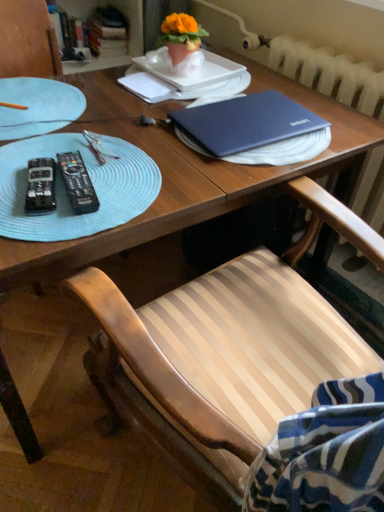
The width and height of the screenshot is (384, 512). What do you see at coordinates (66, 34) in the screenshot?
I see `hardcover book at upper left, placed as the 1th book when sorted from left to right` at bounding box center [66, 34].

This screenshot has width=384, height=512. What are the coordinates of `orange matte flower pot at upper center` in the screenshot? It's located at (181, 36).

What is the approximate height of matte blue laptop at center?

matte blue laptop at center is 1.98 inches in height.

Describe the element at coordinates (246, 122) in the screenshot. I see `matte blue laptop at center` at that location.

The image size is (384, 512). What are the coordinates of `light blue textured glass plate at left, the 1th glass plate in the top-to-bottom sequence` in the screenshot? It's located at (38, 106).

The image size is (384, 512). In order to click on blue woven placemat at left, which is the first glass plate from bottom to top in this screenshot , I will do `click(66, 192)`.

Where is `hardcover book at upper left, placed as the 1th book when sorted from left to right`? This screenshot has height=512, width=384. hardcover book at upper left, placed as the 1th book when sorted from left to right is located at coordinates (66, 34).

Between blue woven placemat at left, the second glass plate viewed from the top, and white textured radiator at upper right, which one has larger size?

Bigger between the two is white textured radiator at upper right.

From the white textured radiator at upper right, count 2nd glass plates forward and point to it. Please provide its 2D coordinates.

[(66, 192)]

From a real-world perspective, is blue woven placemat at left, the second glass plate viewed from the top, under white textured radiator at upper right?

No, from a real-world perspective, blue woven placemat at left, the second glass plate viewed from the top, is not below white textured radiator at upper right.

Is there a large distance between blue woven placemat at left, which is the first glass plate from bottom to top, and white textured radiator at upper right?

blue woven placemat at left, which is the first glass plate from bottom to top, is near white textured radiator at upper right, not far away.

Considering the positions of objects black plastic remote control at left, which is counted as the second remote control, starting from the left, and matte blue laptop at center in the image provided, who is in front, black plastic remote control at left, which is counted as the second remote control, starting from the left, or matte blue laptop at center?

black plastic remote control at left, which is counted as the second remote control, starting from the left.

Which of these two, black plastic remote control at left, the first remote control viewed from the right, or matte blue laptop at center, stands shorter?

With less height is black plastic remote control at left, the first remote control viewed from the right.

Is black plastic remote control at left, which is counted as the second remote control, starting from the left, inside or outside of matte blue laptop at center?

black plastic remote control at left, which is counted as the second remote control, starting from the left, cannot be found inside matte blue laptop at center.

Which object is positioned more to the left, black plastic remote control at left, the first remote control viewed from the right, or matte blue laptop at center?

From the viewer's perspective, black plastic remote control at left, the first remote control viewed from the right, appears more on the left side.

Between orange matte flower pot at upper center and blue woven placemat at left, the second glass plate viewed from the top, which one appears on the left side from the viewer's perspective?

blue woven placemat at left, the second glass plate viewed from the top, is more to the left.

From a real-world perspective, which object stands above the other?

orange matte flower pot at upper center, from a real-world perspective.

Does orange matte flower pot at upper center turn towards blue woven placemat at left, which is the first glass plate from bottom to top?

No, orange matte flower pot at upper center does not turn towards blue woven placemat at left, which is the first glass plate from bottom to top.

Can you tell me how much white paper at upper center and orange matte flower pot at upper center differ in facing direction?

The angle between the facing direction of white paper at upper center and the facing direction of orange matte flower pot at upper center is 0.718 degrees.

Considering the relative sizes of white paper at upper center and orange matte flower pot at upper center in the image provided, is white paper at upper center shorter than orange matte flower pot at upper center?

Indeed, white paper at upper center has a lesser height compared to orange matte flower pot at upper center.

Relative to orange matte flower pot at upper center, is white paper at upper center in front or behind?

Visually, white paper at upper center is located in front of orange matte flower pot at upper center.

Is black plastic remote control at left, which appears as the 1th remote control when viewed from the left, aimed at hardcover book at upper left, which appears as the 2th book when viewed from the right?

No.

Is black plastic remote control at left, the 2th remote control when ordered from right to left, surrounding hardcover book at upper left, which appears as the 2th book when viewed from the right?

No, black plastic remote control at left, the 2th remote control when ordered from right to left, does not contain hardcover book at upper left, which appears as the 2th book when viewed from the right.

Can you confirm if black plastic remote control at left, which appears as the 1th remote control when viewed from the left, is bigger than hardcover book at upper left, placed as the 1th book when sorted from left to right?

No, black plastic remote control at left, which appears as the 1th remote control when viewed from the left, is not bigger than hardcover book at upper left, placed as the 1th book when sorted from left to right.

The width and height of the screenshot is (384, 512). I want to click on the 1st book above the black plastic remote control at left, which appears as the 1th remote control when viewed from the left (from the image's perspective), so click(x=66, y=34).

What are the coordinates of `radiator beneath the black plastic remote control at left, which appears as the 1th remote control when viewed from the left (from a real-world perspective)` in the screenshot? It's located at (330, 74).

From the image's perspective, is white textured radiator at upper right located above or below black plastic remote control at left, the 2th remote control when ordered from right to left?

Based on their image positions, white textured radiator at upper right is located above black plastic remote control at left, the 2th remote control when ordered from right to left.

Is white textured radiator at upper right surrounding black plastic remote control at left, which appears as the 1th remote control when viewed from the left?

No, black plastic remote control at left, which appears as the 1th remote control when viewed from the left, is not inside white textured radiator at upper right.

In the scene shown: Considering the relative sizes of hardcover book at upper left, which appears as the 2th book when viewed from the right, and hardcover book at upper left, the second book in the left-to-right sequence, in the image provided, is hardcover book at upper left, which appears as the 2th book when viewed from the right, smaller than hardcover book at upper left, the second book in the left-to-right sequence,?

Indeed, hardcover book at upper left, which appears as the 2th book when viewed from the right, has a smaller size compared to hardcover book at upper left, the second book in the left-to-right sequence.

From a real-world perspective, relative to hardcover book at upper left, which is the first book from right to left, is hardcover book at upper left, placed as the 1th book when sorted from left to right, vertically above or below?

hardcover book at upper left, placed as the 1th book when sorted from left to right, is below hardcover book at upper left, which is the first book from right to left.

Is hardcover book at upper left, which appears as the 2th book when viewed from the right, facing away from hardcover book at upper left, the second book in the left-to-right sequence?

No, hardcover book at upper left, the second book in the left-to-right sequence, is not at the back of hardcover book at upper left, which appears as the 2th book when viewed from the right.

Find the location of a particular element. The height and width of the screenshot is (512, 384). glass plate that is the 1st object above the white textured radiator at upper right (from a real-world perspective) is located at coordinates (66, 192).

This screenshot has height=512, width=384. In order to click on laptop that appears on the right of black plastic remote control at left, the first remote control viewed from the right in this screenshot , I will do `click(246, 122)`.

When comparing their distances from orange matte flower pot at upper center, does matte blue laptop at center or light blue textured glass plate at left, the second glass plate when ordered from bottom to top, seem closer?

matte blue laptop at center.

Based on their spatial positions, is white paper at upper center or orange matte flower pot at upper center closer to blue woven placemat at left, which is the first glass plate from bottom to top?

white paper at upper center is closer to blue woven placemat at left, which is the first glass plate from bottom to top.

Considering their positions, is black plastic remote control at left, the 2th remote control when ordered from right to left, positioned closer to orange matte flower pot at upper center than matte blue laptop at center?

matte blue laptop at center is positioned closer to the anchor orange matte flower pot at upper center.

Which object lies nearer to the anchor point hardcover book at upper left, which appears as the 2th book when viewed from the right, black plastic remote control at left, the first remote control viewed from the right, or black plastic remote control at left, which appears as the 1th remote control when viewed from the left?

black plastic remote control at left, the first remote control viewed from the right, lies closer to hardcover book at upper left, which appears as the 2th book when viewed from the right, than the other object.

Which object lies nearer to the anchor point white paper at upper center, blue woven placemat at left, the second glass plate viewed from the top, or orange matte flower pot at upper center?

orange matte flower pot at upper center is closer to white paper at upper center.

Considering their positions, is white textured radiator at upper right positioned further to hardcover book at upper left, which appears as the 2th book when viewed from the right, than white paper at upper center?

white textured radiator at upper right.

When comparing their distances from hardcover book at upper left, which is the first book from right to left, does black plastic remote control at left, which is counted as the second remote control, starting from the left, or white paper at upper center seem closer?

white paper at upper center lies closer to hardcover book at upper left, which is the first book from right to left, than the other object.

When comparing their distances from blue woven placemat at left, which is the first glass plate from bottom to top, does light blue textured glass plate at left, the 1th glass plate in the top-to-bottom sequence, or white paper at upper center seem closer?

light blue textured glass plate at left, the 1th glass plate in the top-to-bottom sequence.

You are a GUI agent. You are given a task and a screenshot of the screen. Output one action in this format:
    pyautogui.click(x=<x>, y=<y>)
    Task: Click on the notepad between orange matte flower pot at upper center and black plastic remote control at left, which is counted as the second remote control, starting from the left, vertically
    
    Given the screenshot: What is the action you would take?
    pyautogui.click(x=147, y=87)

Where is `remote control between black plastic remote control at left, the 2th remote control when ordered from right to left, and white paper at upper center in the front-back direction`? The width and height of the screenshot is (384, 512). remote control between black plastic remote control at left, the 2th remote control when ordered from right to left, and white paper at upper center in the front-back direction is located at coordinates (78, 183).

Find the location of `laptop between black plastic remote control at left, the first remote control viewed from the right, and hardcover book at upper left, which is the first book from right to left, along the z-axis`. laptop between black plastic remote control at left, the first remote control viewed from the right, and hardcover book at upper left, which is the first book from right to left, along the z-axis is located at coordinates (246, 122).

I want to click on remote control between black plastic remote control at left, which appears as the 1th remote control when viewed from the left, and hardcover book at upper left, which appears as the 2th book when viewed from the right, in the front-back direction, so click(78, 183).